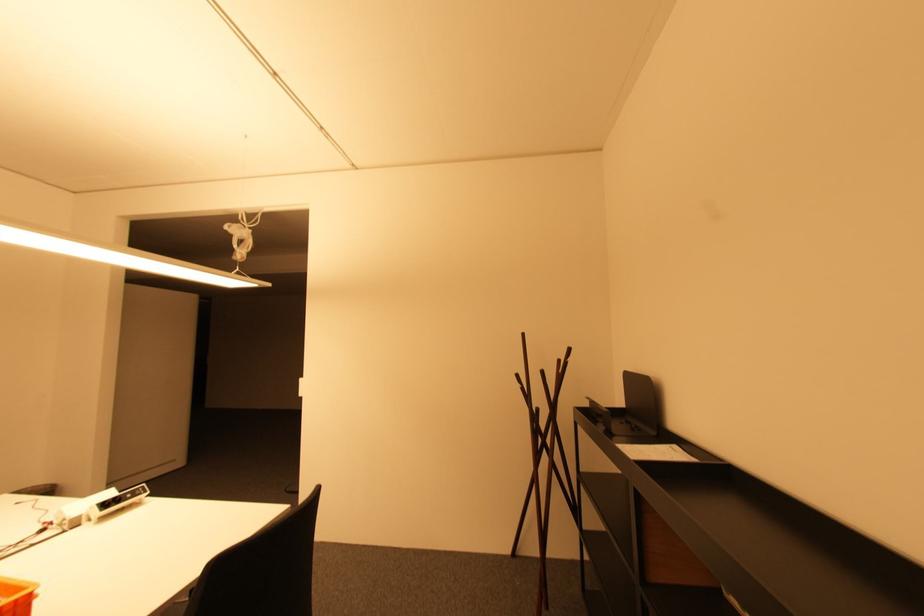
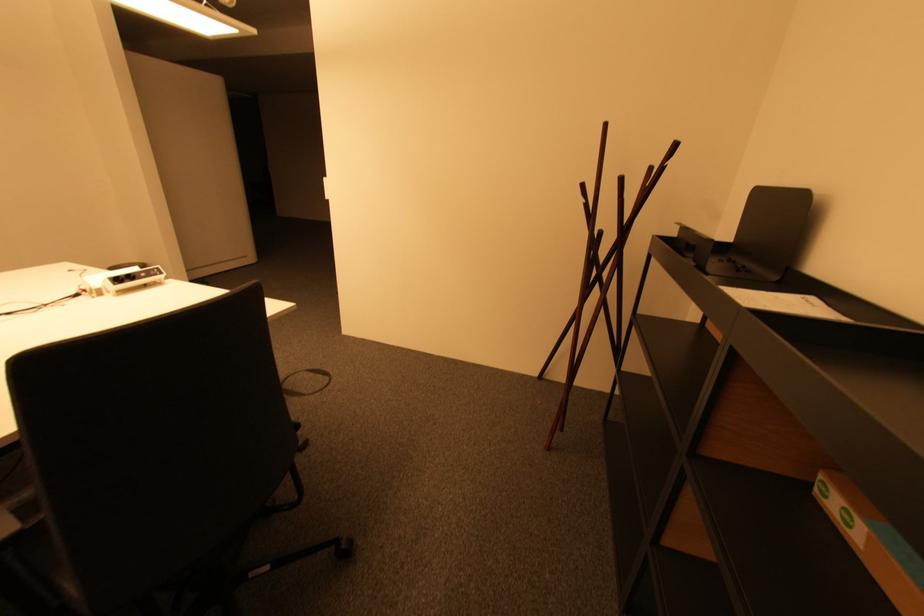
Question: The images are taken continuously from a first-person perspective. In which direction is your viewpoint rotating?

Choices:
 (A) Left
 (B) Right
 (C) Up
 (D) Down

Answer: (D)